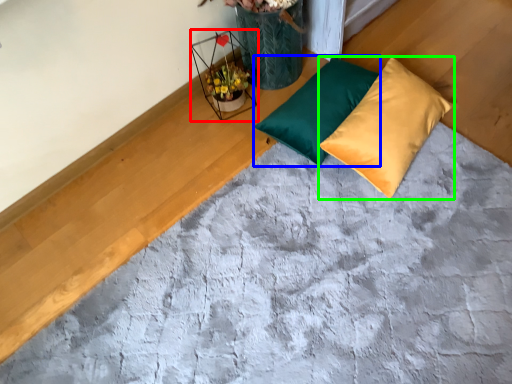
Question: Estimate the real-world distances between objects in this image. Which object is closer to flower basket (highlighted by a red box), pillow (highlighted by a blue box) or pillow (highlighted by a green box)?

Choices:
 (A) pillow
 (B) pillow

Answer: (A)